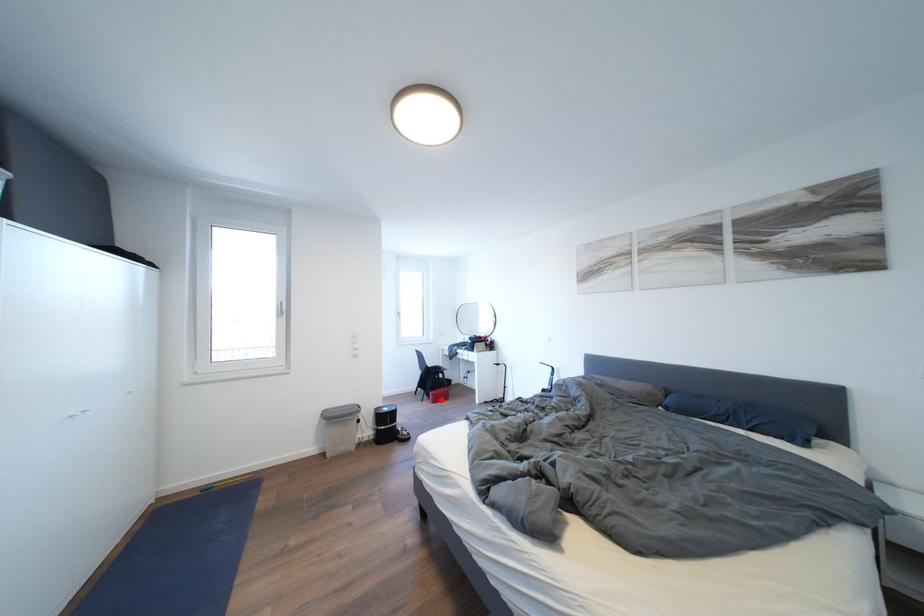
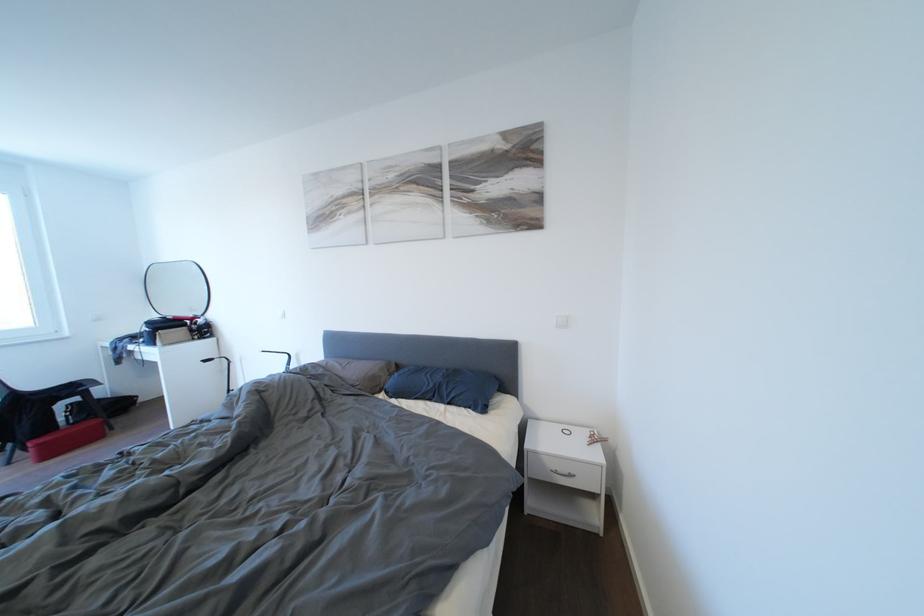
Locate, in the second image, the point that corresponds to the highlighted location in the first image.

(46, 450)